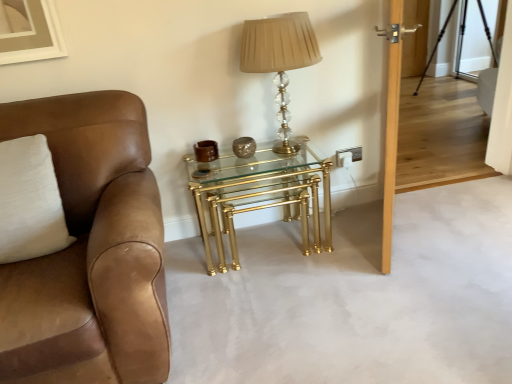
Question: Can you confirm if brown leather chair at left is positioned to the left of transparent glass door at upper right, the second glass door viewed from the left?

Choices:
 (A) yes
 (B) no

Answer: (A)

Question: Considering the relative positions of brown leather chair at left and transparent glass door at upper right, the second glass door viewed from the left, in the image provided, is brown leather chair at left behind transparent glass door at upper right, the second glass door viewed from the left,?

Choices:
 (A) no
 (B) yes

Answer: (A)

Question: From a real-world perspective, is brown leather chair at left positioned over transparent glass door at upper right, which is counted as the first glass door, starting from the right, based on gravity?

Choices:
 (A) yes
 (B) no

Answer: (A)

Question: Is brown leather chair at left bigger than transparent glass door at upper right, the second glass door viewed from the left?

Choices:
 (A) yes
 (B) no

Answer: (A)

Question: Considering the relative sizes of brown leather chair at left and transparent glass door at upper right, the second glass door viewed from the left, in the image provided, is brown leather chair at left smaller than transparent glass door at upper right, the second glass door viewed from the left,?

Choices:
 (A) yes
 (B) no

Answer: (B)

Question: Is point (401, 66) positioned closer to the camera than point (83, 132)?

Choices:
 (A) farther
 (B) closer

Answer: (A)

Question: Considering their positions, is clear glass door at upper right, the second glass door positioned from the right, located in front of or behind brown leather chair at left?

Choices:
 (A) front
 (B) behind

Answer: (B)

Question: From a real-world perspective, is clear glass door at upper right, the 1th glass door when ordered from left to right, physically located above or below brown leather chair at left?

Choices:
 (A) below
 (B) above

Answer: (A)

Question: Based on their positions, is clear glass door at upper right, the 1th glass door when ordered from left to right, located to the left or right of brown leather chair at left?

Choices:
 (A) right
 (B) left

Answer: (A)

Question: Is transparent glass door at upper right, the second glass door viewed from the left, in front of or behind brown leather chair at left in the image?

Choices:
 (A) behind
 (B) front

Answer: (A)

Question: From the image's perspective, is transparent glass door at upper right, the second glass door viewed from the left, located above or below brown leather chair at left?

Choices:
 (A) below
 (B) above

Answer: (B)

Question: Looking at their shapes, would you say transparent glass door at upper right, the second glass door viewed from the left, is wider or thinner than brown leather chair at left?

Choices:
 (A) wide
 (B) thin

Answer: (B)

Question: Visually, is transparent glass door at upper right, which is counted as the first glass door, starting from the right, positioned to the left or to the right of brown leather chair at left?

Choices:
 (A) left
 (B) right

Answer: (B)

Question: Which is correct: transparent glass door at upper right, the second glass door viewed from the left, is inside white soft pillow at left, or outside of it?

Choices:
 (A) outside
 (B) inside

Answer: (A)

Question: Looking at the image, does transparent glass door at upper right, which is counted as the first glass door, starting from the right, seem bigger or smaller compared to white soft pillow at left?

Choices:
 (A) big
 (B) small

Answer: (B)